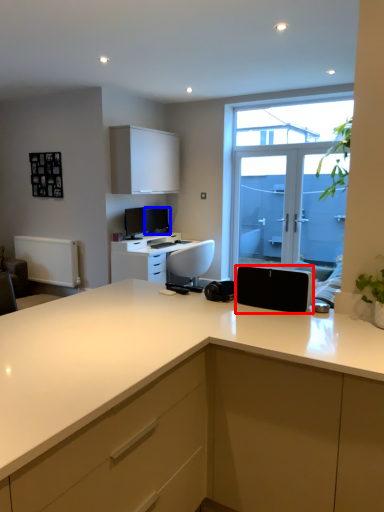
Question: Which point is further to the camera, appliance (highlighted by a red box) or computer monitor (highlighted by a blue box)?

Choices:
 (A) appliance
 (B) computer monitor

Answer: (B)